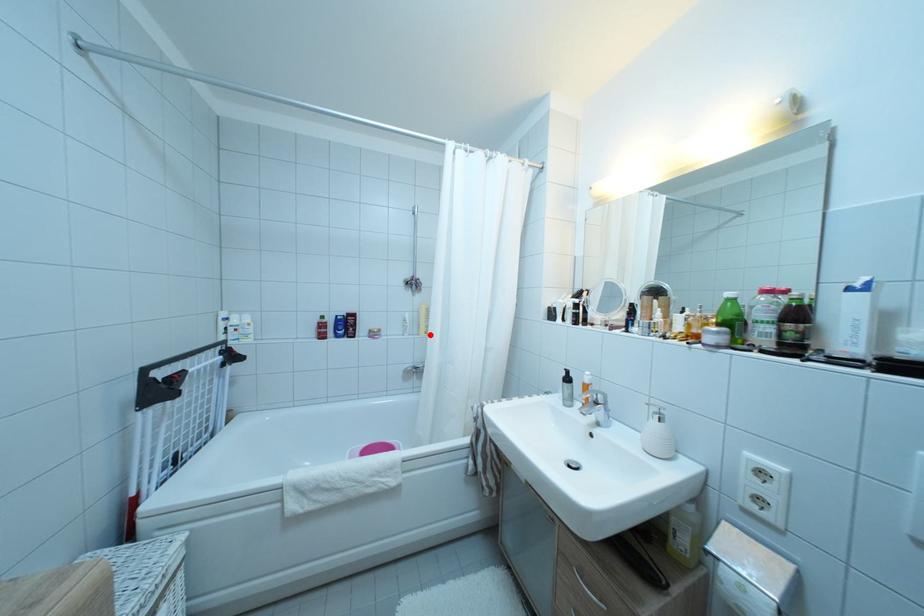
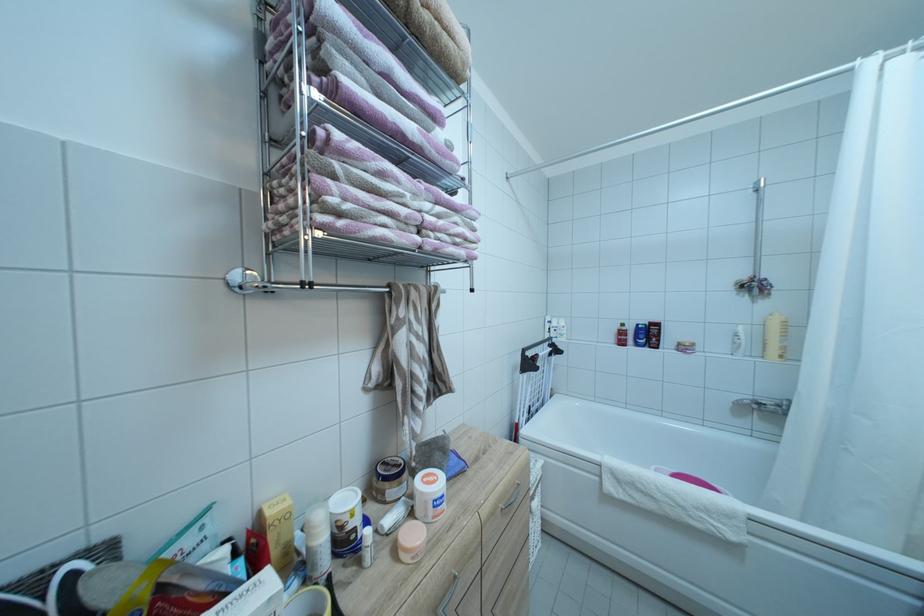
Find the pixel in the second image that matches the highlighted location in the first image.

(781, 357)